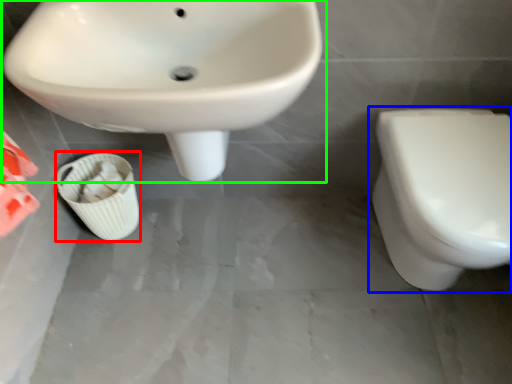
Question: Based on their relative distances, which object is farther from potty (highlighted by a red box)? Choose from toilet (highlighted by a blue box) and sink (highlighted by a green box).

Choices:
 (A) toilet
 (B) sink

Answer: (A)